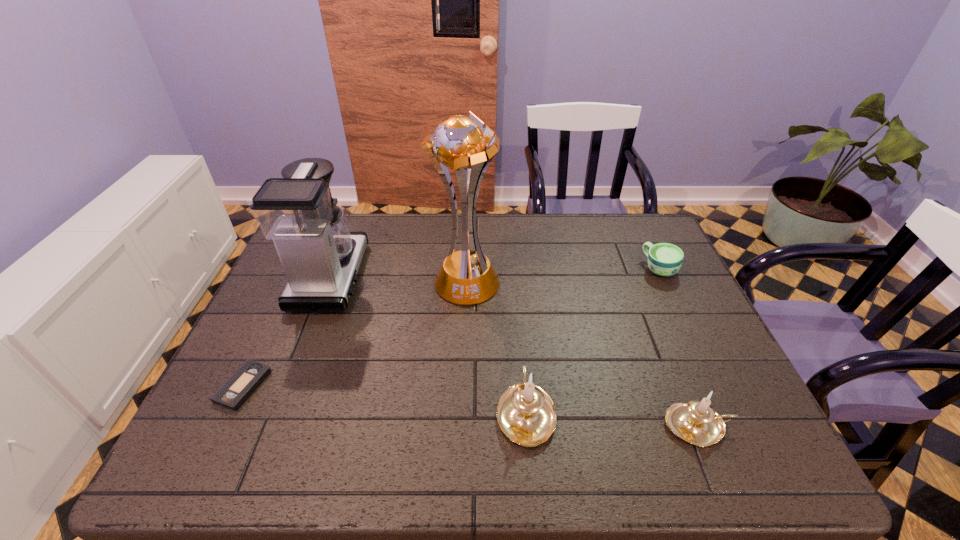
Locate an element on the screen. This screenshot has width=960, height=540. free location at the near right corner of the desktop is located at coordinates pos(699,395).

Where is `free space between the coffee maker and the shortest object`? This screenshot has width=960, height=540. free space between the coffee maker and the shortest object is located at coordinates coord(287,332).

The image size is (960, 540). Find the location of `free space between the shorter candle holder and the second tallest object`. free space between the shorter candle holder and the second tallest object is located at coordinates (515, 352).

At what (x,y) coordinates should I click in order to perform the action: click on vacant area between the shortest object and the fifth shortest object. Please return your answer as a coordinate pair (x, y). The height and width of the screenshot is (540, 960). Looking at the image, I should click on (287, 332).

This screenshot has height=540, width=960. What are the coordinates of `empty space between the trophy and the taller candle holder` in the screenshot? It's located at (495, 347).

The height and width of the screenshot is (540, 960). I want to click on free area in between the taller candle holder and the fifth shortest object, so click(x=428, y=345).

Find the location of `free point between the tallest object and the cup`. free point between the tallest object and the cup is located at coordinates (563, 275).

Where is `free space that is in between the fifth tallest object and the third shortest object`? The height and width of the screenshot is (540, 960). free space that is in between the fifth tallest object and the third shortest object is located at coordinates (679, 347).

You are a GUI agent. You are given a task and a screenshot of the screen. Output one action in this format:
    pyautogui.click(x=<x>, y=<y>)
    Task: Click on the empty space between the right candle holder and the videotape
    
    Given the screenshot: What is the action you would take?
    pyautogui.click(x=470, y=406)

You are a GUI agent. You are given a task and a screenshot of the screen. Output one action in this format:
    pyautogui.click(x=<x>, y=<y>)
    Task: Click on the closest object to the right candle holder
    Image resolution: width=960 pixels, height=540 pixels.
    Given the screenshot: What is the action you would take?
    pyautogui.click(x=525, y=413)